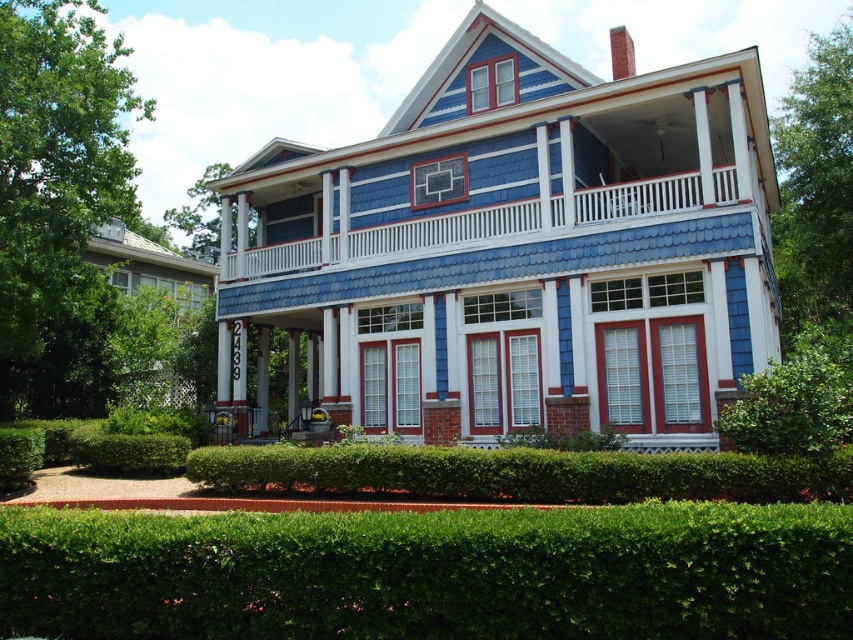
Who is taller, green leafy hedge at lower center or green leafy hedge at center?

Standing taller between the two is green leafy hedge at center.

Is the position of green leafy hedge at lower center more distant than that of green leafy hedge at center?

No, green leafy hedge at lower center is closer to the viewer.

Which is behind, point (538, 579) or point (703, 474)?

Positioned behind is point (703, 474).

Identify the location of green leafy hedge at lower center. (432, 573).

Between green leafy hedge at center and blue shingles at upper center, which one is positioned lower?

green leafy hedge at center is lower down.

Does green leafy hedge at center have a greater width compared to blue shingles at upper center?

No, green leafy hedge at center is not wider than blue shingles at upper center.

Which is in front, point (798, 500) or point (381, 250)?

Point (798, 500)

Identify the location of green leafy hedge at center. (519, 474).

Is green leafy hedge at lower center wider than green leafy bush at lower right?

Yes, green leafy hedge at lower center is wider than green leafy bush at lower right.

Measure the distance between green leafy hedge at lower center and camera.

green leafy hedge at lower center and camera are 30.74 feet apart.

Between point (846, 538) and point (782, 372), which one is positioned in front?

Point (846, 538) is in front.

I want to click on green leafy hedge at lower center, so click(x=432, y=573).